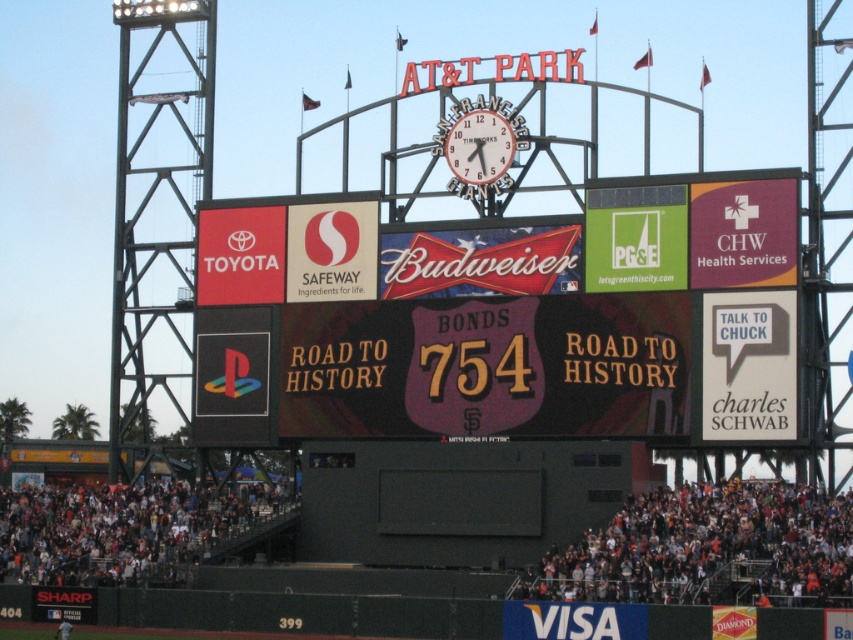
You are a photographer standing at the entrance of AT T Park and want to capture both the black matte scoreboard at center and the white metallic clock at center in a single shot. Based on their relative widths, which object should you position closer to the edge of the frame to ensure both fit?

The black matte scoreboard at center might be wider than the white metallic clock at center, so to ensure both fit in the frame, position the wider black matte scoreboard at center closer to the center and the narrower white metallic clock at center near the edge.

You are a photographer at AT T Park and need to capture both the black matte scoreboard at center and the white metallic clock at center in a single photo. Given that your camera can only focus on one object at a time, which object should you prioritize focusing on to ensure it appears sharp and clear in the photo?

Since the black matte scoreboard at center is larger in size than the white metallic clock at center, you should prioritize focusing on the black matte scoreboard at center to ensure it appears sharp and clear in the photo.

You are at ATandT Park and want to locate the white metallic clock at center. Where would you look in relation to the black matte scoreboard at center?

The white metallic clock at center is located above the black matte scoreboard at center.